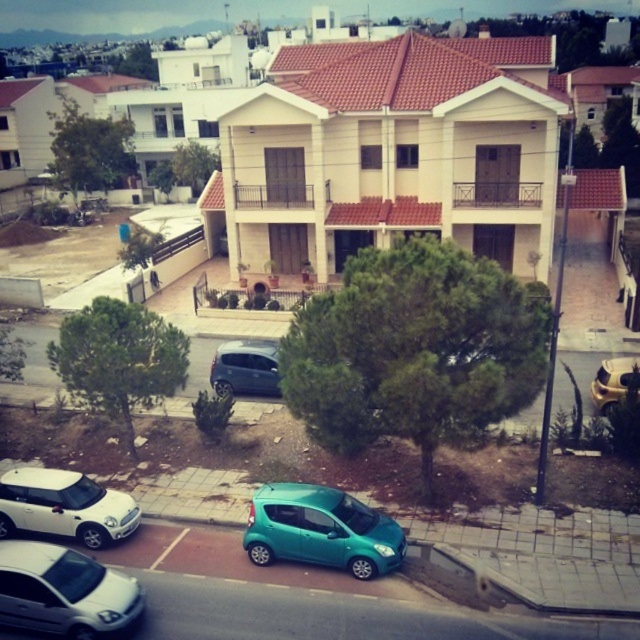
You are a delivery person trying to park your gold metallic helmet at upper right in the residential area. There is a white matte car at lower left already parked nearby. Considering their heights, can you safely place the helmet on top of the car without it touching the ground?

The white matte car at lower left is much taller than the gold metallic helmet at upper right. Since the car is taller, placing the helmet on top would likely keep it elevated above the ground, so yes, it can be safely placed there.

You are a pedestrian standing on the sidewalk in front of the two story building in the center. You see a metallic gray hatchback at center and a gold metallic helmet at upper right. Which object is positioned higher from the ground?

The metallic gray hatchback at center is positioned higher from the ground than the gold metallic helmet at upper right because it is stated to be above it.